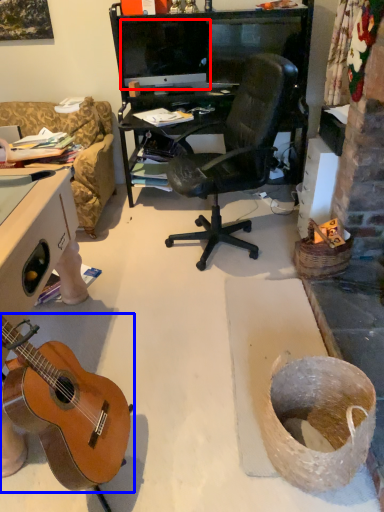
Question: Which of the following is the farthest to the observer, computer monitor (highlighted by a red box) or guitar (highlighted by a blue box)?

Choices:
 (A) computer monitor
 (B) guitar

Answer: (A)